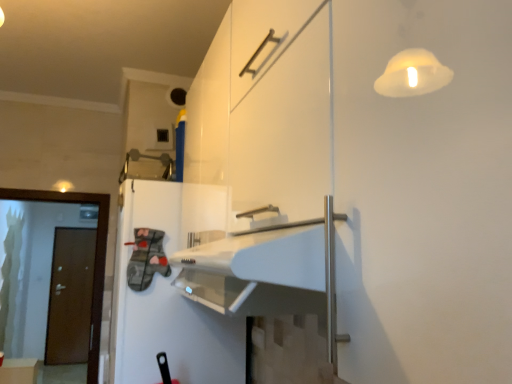
Where is `free location above brown matte door at left (from a real-world perspective)`? free location above brown matte door at left (from a real-world perspective) is located at coordinates (42, 183).